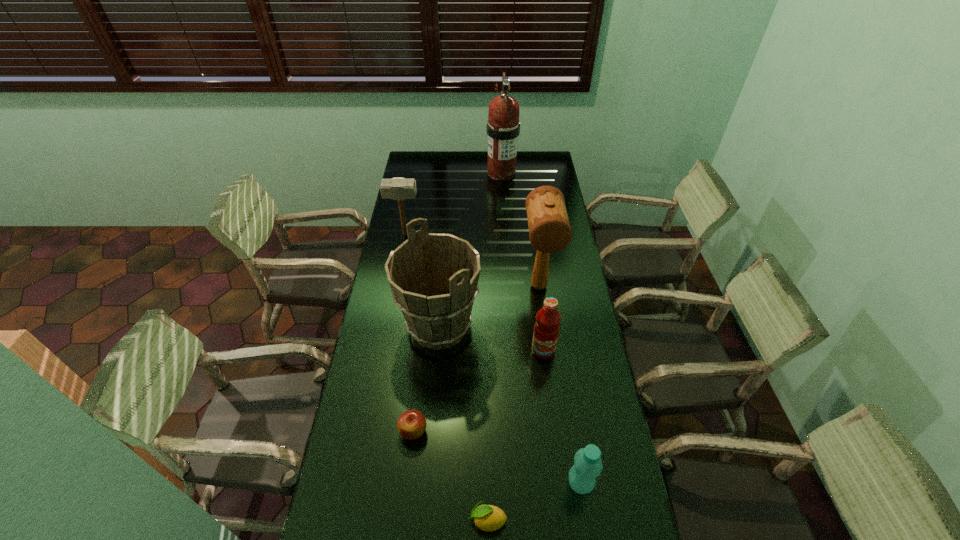
Where is `apple`? This screenshot has width=960, height=540. apple is located at coordinates (411, 424).

In order to click on the nearest object in this screenshot , I will do `click(488, 518)`.

In order to click on lemon in this screenshot , I will do `click(488, 518)`.

Identify the location of vacant space located at the nozzle of the farthest object. This screenshot has width=960, height=540. (504, 209).

Where is `blank space located on the strike surface of the right mallet`? This screenshot has height=540, width=960. blank space located on the strike surface of the right mallet is located at coordinates (548, 356).

Find the location of a particular element. This screenshot has height=540, width=960. vacant area situated 0.190m on the back of the bucket is located at coordinates (444, 264).

At what (x,y) coordinates should I click in order to perform the action: click on vacant area located 0.340m on the striking face of the second farthest object. Please return your answer as a coordinate pair (x, y). This screenshot has width=960, height=540. Looking at the image, I should click on (495, 234).

This screenshot has height=540, width=960. I want to click on vacant space located on the front label of the fruit juice, so click(553, 426).

I want to click on free space located on the back of the bottle, so click(565, 387).

At what (x,y) coordinates should I click in order to perform the action: click on vacant space positioned on the back of the apple. Please return your answer as a coordinate pair (x, y). The height and width of the screenshot is (540, 960). Looking at the image, I should click on (419, 384).